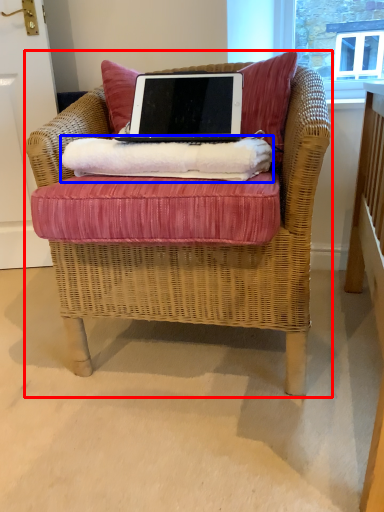
Question: Which of the following is the closest to the observer, chair (highlighted by a red box) or material (highlighted by a blue box)?

Choices:
 (A) chair
 (B) material

Answer: (A)